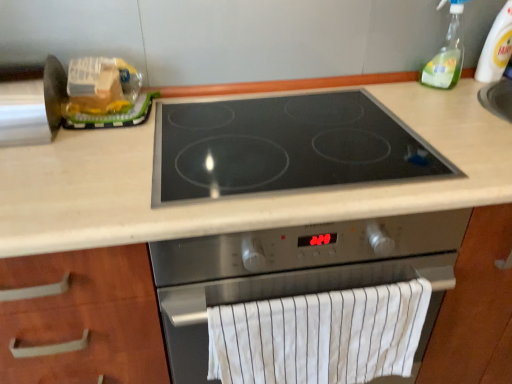
The width and height of the screenshot is (512, 384). Describe the element at coordinates (102, 86) in the screenshot. I see `translucent plastic bag at upper left` at that location.

The width and height of the screenshot is (512, 384). Describe the element at coordinates (319, 336) in the screenshot. I see `white striped towel at lower center` at that location.

Find the location of `clear plastic bottle at upper right`. clear plastic bottle at upper right is located at coordinates (496, 47).

Can black glass cooktop at center be found inside translucent plastic bag at upper left?

Actually, black glass cooktop at center is outside translucent plastic bag at upper left.

Is translucent plastic bag at upper left facing away from black glass cooktop at center?

translucent plastic bag at upper left is not turned away from black glass cooktop at center.

From a real-world perspective, is translucent plastic bag at upper left located beneath black glass cooktop at center?

No.

Looking at this image, is stainless steel cooktop at center directly adjacent to black glass cooktop at center?

No, stainless steel cooktop at center is not with black glass cooktop at center.

Is stainless steel cooktop at center located outside black glass cooktop at center?

stainless steel cooktop at center is positioned outside black glass cooktop at center.

Can you tell me how much stainless steel cooktop at center and black glass cooktop at center differ in facing direction?

There is a 1.06-degree angle between the facing directions of stainless steel cooktop at center and black glass cooktop at center.

Is stainless steel cooktop at center wider than black glass cooktop at center?

Indeed, stainless steel cooktop at center has a greater width compared to black glass cooktop at center.

In the scene shown: From a real-world perspective, between translucent plastic bag at upper left and stainless steel cooktop at center, who is vertically higher?

translucent plastic bag at upper left.

You are a GUI agent. You are given a task and a screenshot of the screen. Output one action in this format:
    pyautogui.click(x=<x>, y=<y>)
    Task: Click on the food on the left of stainless steel cooktop at center
    This screenshot has height=384, width=512.
    Given the screenshot: What is the action you would take?
    pyautogui.click(x=102, y=86)

Measure the distance from translucent plastic bag at upper left to stainless steel cooktop at center.

translucent plastic bag at upper left and stainless steel cooktop at center are 22.23 inches apart.

Is translucent plastic bag at upper left at the right side of stainless steel cooktop at center?

No, translucent plastic bag at upper left is not to the right of stainless steel cooktop at center.

Considering the relative sizes of clear plastic bottle at upper right and translucent plastic bag at upper left in the image provided, is clear plastic bottle at upper right thinner than translucent plastic bag at upper left?

Correct, the width of clear plastic bottle at upper right is less than that of translucent plastic bag at upper left.

At what (x,y) coordinates should I click in order to perform the action: click on food that appears below the clear plastic bottle at upper right (from the image's perspective). Please return your answer as a coordinate pair (x, y). The height and width of the screenshot is (384, 512). Looking at the image, I should click on (102, 86).

Visually, is clear plastic bottle at upper right positioned to the left or to the right of translucent plastic bag at upper left?

clear plastic bottle at upper right is to the right of translucent plastic bag at upper left.

From a real-world perspective, is clear plastic bottle at upper right positioned above or below stainless steel cooktop at center?

From a real-world perspective, clear plastic bottle at upper right is physically above stainless steel cooktop at center.

Can you confirm if clear plastic bottle at upper right is smaller than stainless steel cooktop at center?

Yes.

Is clear plastic bottle at upper right outside of stainless steel cooktop at center?

Yes.

Based on the photo, does clear plastic bottle at upper right turn towards stainless steel cooktop at center?

No, clear plastic bottle at upper right is not facing towards stainless steel cooktop at center.

Considering the sizes of objects clear plastic bottle at upper right and stainless steel cooktop at center in the image provided, who is shorter, clear plastic bottle at upper right or stainless steel cooktop at center?

With less height is clear plastic bottle at upper right.

I want to click on kitchen appliance to the left of clear plastic bottle at upper right, so click(293, 272).

In the scene shown: Is clear plastic bottle at upper right to the left of stainless steel cooktop at center from the viewer's perspective?

In fact, clear plastic bottle at upper right is to the right of stainless steel cooktop at center.

From a real-world perspective, which is physically above, black glass cooktop at center or clear plastic bottle at upper right?

clear plastic bottle at upper right is physically above.

Is black glass cooktop at center spatially inside clear plastic bottle at upper right, or outside of it?

black glass cooktop at center cannot be found inside clear plastic bottle at upper right.

Is black glass cooktop at center oriented away from clear plastic bottle at upper right?

black glass cooktop at center is not turned away from clear plastic bottle at upper right.

Which is in front, black glass cooktop at center or clear plastic bottle at upper right?

black glass cooktop at center is closer to the camera.

At what (x,y) coordinates should I click in order to perform the action: click on gas stove lying below the translucent plastic bag at upper left (from the image's perspective). Please return your answer as a coordinate pair (x, y). Looking at the image, I should click on (285, 146).

I want to click on kitchen appliance below the black glass cooktop at center (from a real-world perspective), so [x=293, y=272].

Based on the photo, considering their positions, is white striped towel at lower center positioned closer to black glass cooktop at center than clear plastic bottle at upper right?

white striped towel at lower center is closer to black glass cooktop at center.

Considering their positions, is stainless steel cooktop at center positioned closer to clear plastic bottle at upper right than black glass cooktop at center?

The object closer to clear plastic bottle at upper right is black glass cooktop at center.

Looking at the image, which one is located closer to clear plastic bottle at upper right, clear plastic bottle at upper right or white striped towel at lower center?

clear plastic bottle at upper right lies closer to clear plastic bottle at upper right than the other object.

When comparing their distances from clear plastic bottle at upper right, does clear plastic bottle at upper right or stainless steel cooktop at center seem closer?

clear plastic bottle at upper right lies closer to clear plastic bottle at upper right than the other object.

Considering their positions, is translucent plastic bag at upper left positioned further to black glass cooktop at center than clear plastic bottle at upper right?

The object further to black glass cooktop at center is clear plastic bottle at upper right.

From the image, which object appears to be farther from translucent plastic bag at upper left, clear plastic bottle at upper right or stainless steel cooktop at center?

Among the two, clear plastic bottle at upper right is located further to translucent plastic bag at upper left.

Estimate the real-world distances between objects in this image. Which object is further from white striped towel at lower center, clear plastic bottle at upper right or black glass cooktop at center?

clear plastic bottle at upper right lies further to white striped towel at lower center than the other object.

Looking at the image, which one is located closer to clear plastic bottle at upper right, translucent plastic bag at upper left or white striped towel at lower center?

white striped towel at lower center.

Identify the location of soap dispenser between translucent plastic bag at upper left and clear plastic bottle at upper right. Image resolution: width=512 pixels, height=384 pixels. (447, 53).

Image resolution: width=512 pixels, height=384 pixels. I want to click on gas stove between translucent plastic bag at upper left and stainless steel cooktop at center, so click(x=285, y=146).

Locate an element on the screen. The width and height of the screenshot is (512, 384). soap dispenser between clear plastic bottle at upper right and white striped towel at lower center vertically is located at coordinates (447, 53).

You are a GUI agent. You are given a task and a screenshot of the screen. Output one action in this format:
    pyautogui.click(x=<x>, y=<y>)
    Task: Click on the gas stove between translucent plastic bag at upper left and clear plastic bottle at upper right from left to right
    
    Given the screenshot: What is the action you would take?
    pyautogui.click(x=285, y=146)